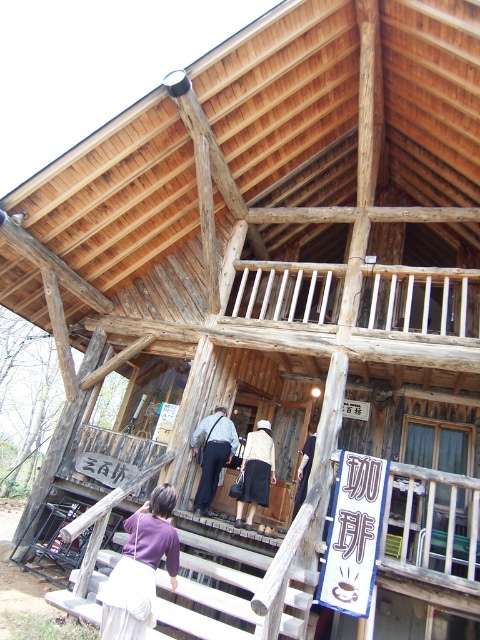
At what (x,y) coordinates should I click in order to perform the action: click on purple fabric bag at lower center. Please return your answer as a coordinate pair (x, y). Looking at the image, I should click on (140, 568).

Is purple fabric bag at lower center thinner than white cotton shirt at center?

No, purple fabric bag at lower center is not thinner than white cotton shirt at center.

The width and height of the screenshot is (480, 640). I want to click on purple fabric bag at lower center, so click(x=140, y=568).

Is dark gray fabric bag at center positioned behind dark blue fabric pants at center?

No.

Is point (217, 474) more distant than point (307, 451)?

That is False.

Where is `dark gray fabric bag at center`? The height and width of the screenshot is (640, 480). dark gray fabric bag at center is located at coordinates click(212, 452).

Does purple fabric bag at lower center have a lesser width compared to dark gray fabric bag at center?

Yes, purple fabric bag at lower center is thinner than dark gray fabric bag at center.

Describe the element at coordinates (140, 568) in the screenshot. I see `purple fabric bag at lower center` at that location.

Identify the location of purple fabric bag at lower center. Image resolution: width=480 pixels, height=640 pixels. (140, 568).